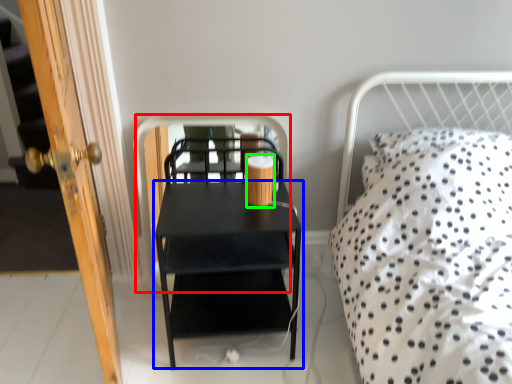
Question: Which object is the farthest from screen door (highlighted by a red box)? Choose among these: nightstand (highlighted by a blue box) or coffee cup (highlighted by a green box).

Choices:
 (A) nightstand
 (B) coffee cup

Answer: (B)